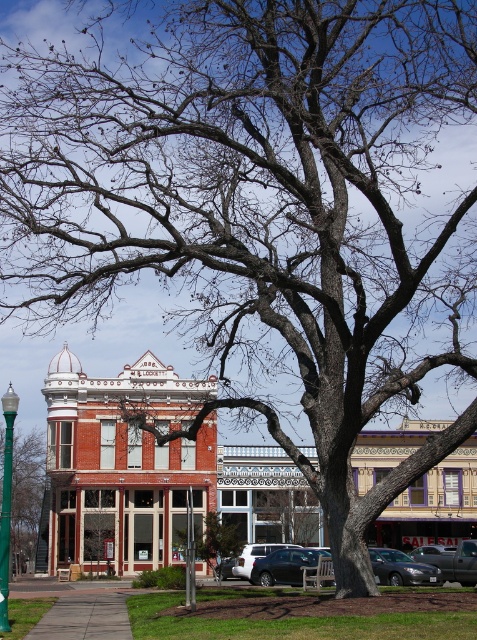
Question: Which object is the closest to the white matte suv at lower center?

Choices:
 (A) satin black sedan at lower right
 (B) gray concrete sidewalk at lower left
 (C) silver metallic sedan at center

Answer: (C)

Question: Which point is farther to the camera?

Choices:
 (A) (10, 432)
 (B) (145, 468)

Answer: (B)

Question: Does green metallic pole at left appear on the right side of satin black sedan at lower right?

Choices:
 (A) no
 (B) yes

Answer: (A)

Question: Is green matte lamp post at left further to camera compared to metallic silver car at lower center?

Choices:
 (A) yes
 (B) no

Answer: (B)

Question: Among these points, which one is farthest from the camera?

Choices:
 (A) (299, 582)
 (B) (460, 486)
 (C) (389, 548)
 (D) (236, 560)

Answer: (B)

Question: From the image, what is the correct spatial relationship of gray concrete sidewalk at lower left in relation to metallic silver car at lower center?

Choices:
 (A) left
 (B) right

Answer: (A)